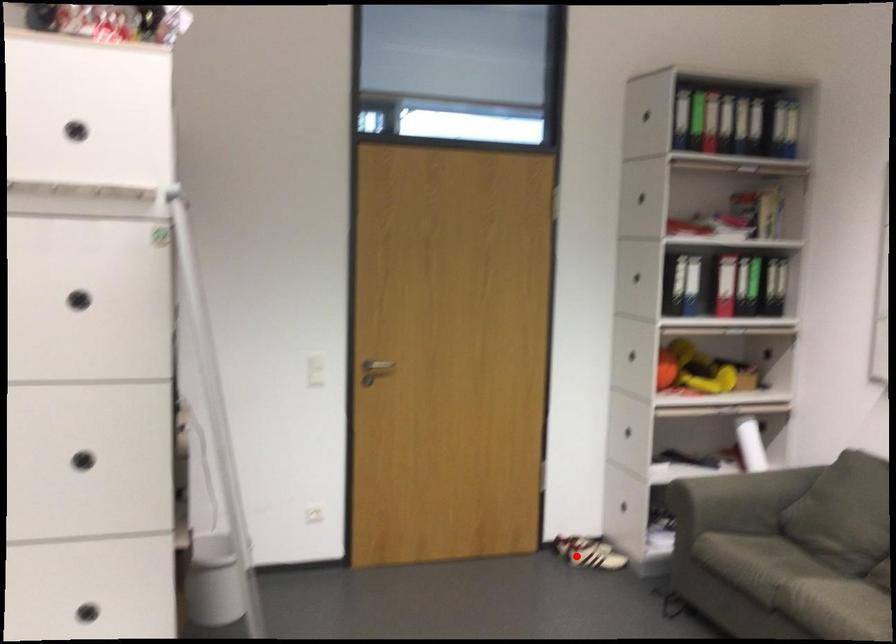
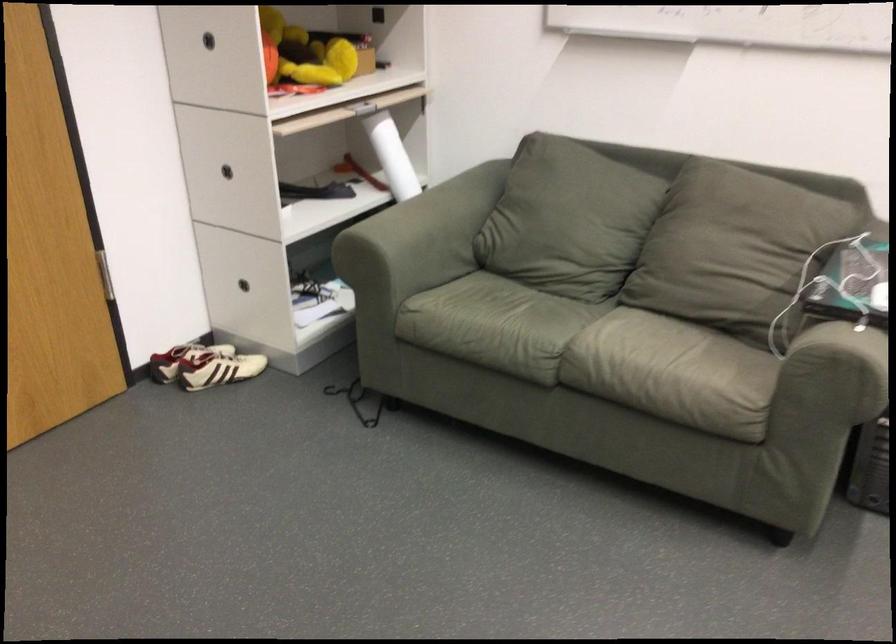
Find the pixel in the second image that matches the highlighted location in the first image.

(218, 368)